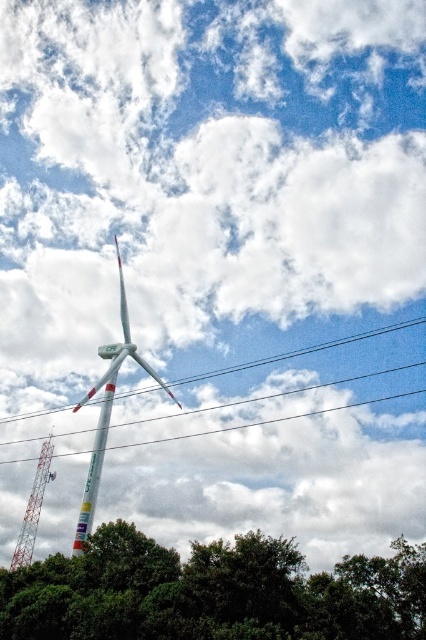
Question: Does green leafy tree at lower center have a smaller size compared to white painted metal wind turbine at center?

Choices:
 (A) yes
 (B) no

Answer: (B)

Question: Which object appears farthest from the camera in this image?

Choices:
 (A) green leafy tree at lower center
 (B) white plastic power line at center
 (C) white painted metal wind turbine at center

Answer: (B)

Question: Can you confirm if green leafy tree at lower center is bigger than white painted metal windmill at left?

Choices:
 (A) yes
 (B) no

Answer: (A)

Question: Which point is closer to the camera taking this photo?

Choices:
 (A) (34, 506)
 (B) (247, 365)

Answer: (B)

Question: Which point is farther to the camera?

Choices:
 (A) green leafy tree at lower center
 (B) white painted metal wind turbine at center

Answer: (B)

Question: Does green leafy tree at lower center appear on the right side of white painted metal wind turbine at center?

Choices:
 (A) yes
 (B) no

Answer: (A)